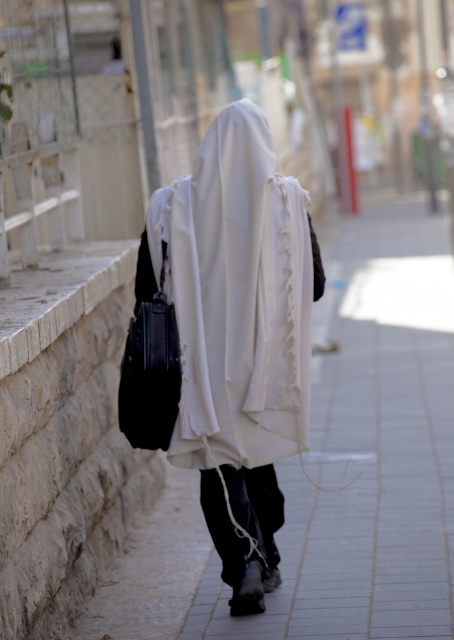
Does white fabric at center come in front of white fabric robe at center?

Yes, it is.

Is white fabric at center further to camera compared to white fabric robe at center?

That is False.

Find the location of a particular element. white fabric at center is located at coordinates (332, 467).